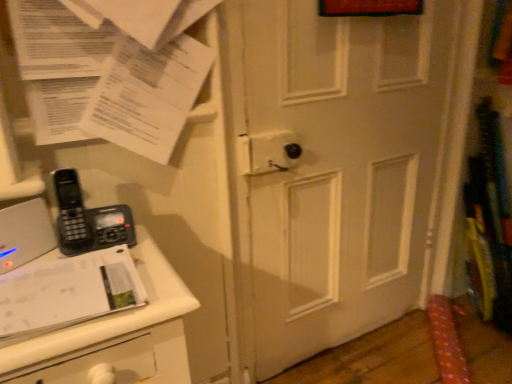
The width and height of the screenshot is (512, 384). Find the location of `vacant area located to the right-hand side of black plastic phone at left`. vacant area located to the right-hand side of black plastic phone at left is located at coordinates (143, 256).